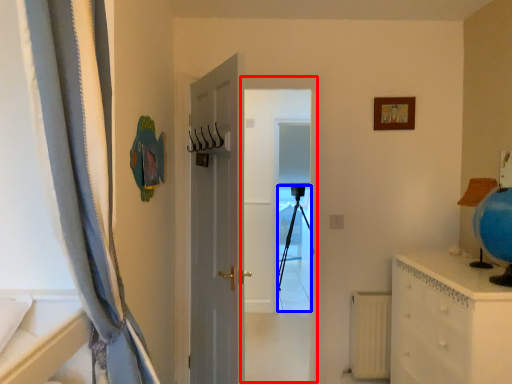
Question: Among these objects, which one is farthest to the camera, screen door (highlighted by a red box) or tripod (highlighted by a blue box)?

Choices:
 (A) screen door
 (B) tripod

Answer: (B)